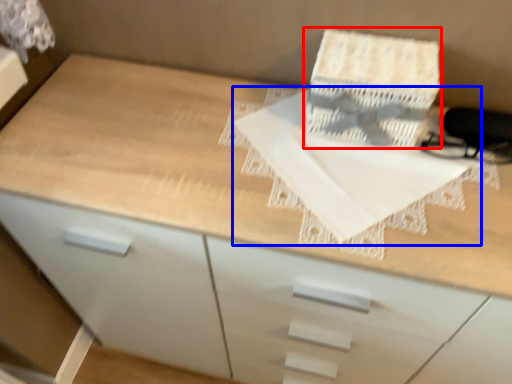
Question: Among these objects, which one is farthest to the camera, cardboard box (highlighted by a red box) or sheet (highlighted by a blue box)?

Choices:
 (A) cardboard box
 (B) sheet

Answer: (A)